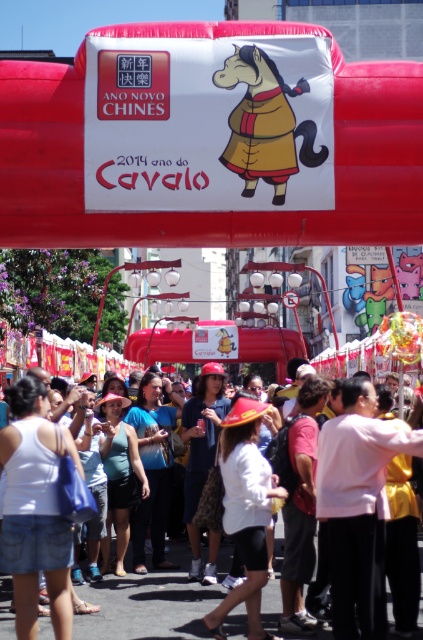
Question: Considering the relative positions of matte red inflatable horse at center and white cotton crowd at center in the image provided, where is matte red inflatable horse at center located with respect to white cotton crowd at center?

Choices:
 (A) below
 (B) above

Answer: (B)

Question: Is matte red inflatable horse at center closer to the viewer compared to white cotton crowd at center?

Choices:
 (A) no
 (B) yes

Answer: (A)

Question: Does matte red inflatable horse at center appear under white cotton crowd at center?

Choices:
 (A) yes
 (B) no

Answer: (B)

Question: Which object is farther from the camera taking this photo?

Choices:
 (A) white cotton crowd at center
 (B) matte red inflatable horse at center

Answer: (B)

Question: Which point is closer to the camera taking this photo?

Choices:
 (A) (129, 636)
 (B) (27, 228)

Answer: (A)